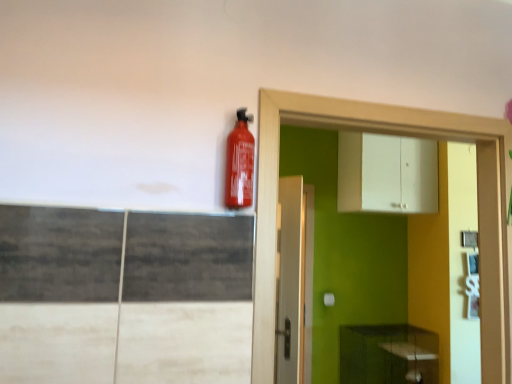
Question: Does green matte cabinet at lower right, which appears as the 1th cabinetry when ordered from the bottom, have a lesser width compared to white glossy dresser at upper right?

Choices:
 (A) yes
 (B) no

Answer: (B)

Question: Considering the relative sizes of green matte cabinet at lower right, arranged as the second cabinetry when viewed from the top, and white glossy dresser at upper right in the image provided, is green matte cabinet at lower right, arranged as the second cabinetry when viewed from the top, bigger than white glossy dresser at upper right?

Choices:
 (A) yes
 (B) no

Answer: (A)

Question: Is green matte cabinet at lower right, which appears as the 1th cabinetry when ordered from the bottom, not inside white glossy dresser at upper right?

Choices:
 (A) no
 (B) yes

Answer: (B)

Question: From the image's perspective, is green matte cabinet at lower right, which appears as the 1th cabinetry when ordered from the bottom, under white glossy dresser at upper right?

Choices:
 (A) yes
 (B) no

Answer: (A)

Question: From the image's perspective, is green matte cabinet at lower right, which appears as the 1th cabinetry when ordered from the bottom, over white glossy dresser at upper right?

Choices:
 (A) no
 (B) yes

Answer: (A)

Question: Visually, is matte red extinguisher at upper center positioned to the left or to the right of green matte cabinet at lower right, arranged as the second cabinetry when viewed from the top?

Choices:
 (A) left
 (B) right

Answer: (A)

Question: Considering the positions of matte red extinguisher at upper center and green matte cabinet at lower right, which appears as the 1th cabinetry when ordered from the bottom, in the image, is matte red extinguisher at upper center bigger or smaller than green matte cabinet at lower right, which appears as the 1th cabinetry when ordered from the bottom,?

Choices:
 (A) small
 (B) big

Answer: (A)

Question: Is matte red extinguisher at upper center in front of or behind green matte cabinet at lower right, which appears as the 1th cabinetry when ordered from the bottom, in the image?

Choices:
 (A) behind
 (B) front

Answer: (B)

Question: Do you think matte red extinguisher at upper center is within green matte cabinet at lower right, which appears as the 1th cabinetry when ordered from the bottom, or outside of it?

Choices:
 (A) inside
 (B) outside

Answer: (B)

Question: Do you think matte red extinguisher at upper center is within white glossy dresser at upper right, or outside of it?

Choices:
 (A) inside
 (B) outside

Answer: (B)

Question: Looking at their shapes, would you say matte red extinguisher at upper center is wider or thinner than white glossy dresser at upper right?

Choices:
 (A) thin
 (B) wide

Answer: (A)

Question: Relative to white glossy dresser at upper right, is matte red extinguisher at upper center in front or behind?

Choices:
 (A) behind
 (B) front

Answer: (B)

Question: Considering the positions of matte red extinguisher at upper center and white glossy dresser at upper right in the image, is matte red extinguisher at upper center taller or shorter than white glossy dresser at upper right?

Choices:
 (A) tall
 (B) short

Answer: (B)

Question: From the image's perspective, is white matte cabinet at upper center, which is the first cabinetry in top-to-bottom order, positioned above or below white glossy dresser at upper right?

Choices:
 (A) below
 (B) above

Answer: (B)

Question: Is white matte cabinet at upper center, acting as the second cabinetry starting from the bottom, inside the boundaries of white glossy dresser at upper right, or outside?

Choices:
 (A) inside
 (B) outside

Answer: (B)